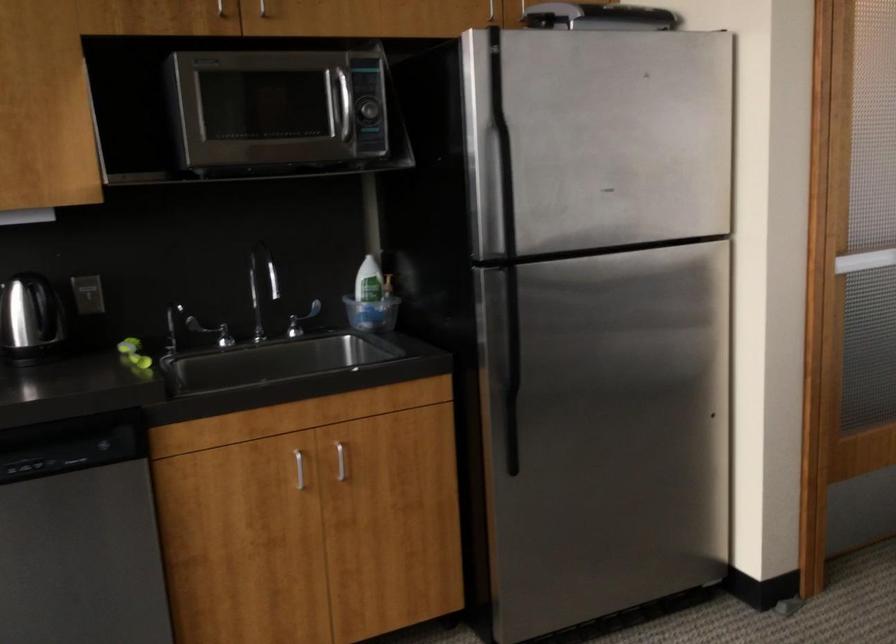
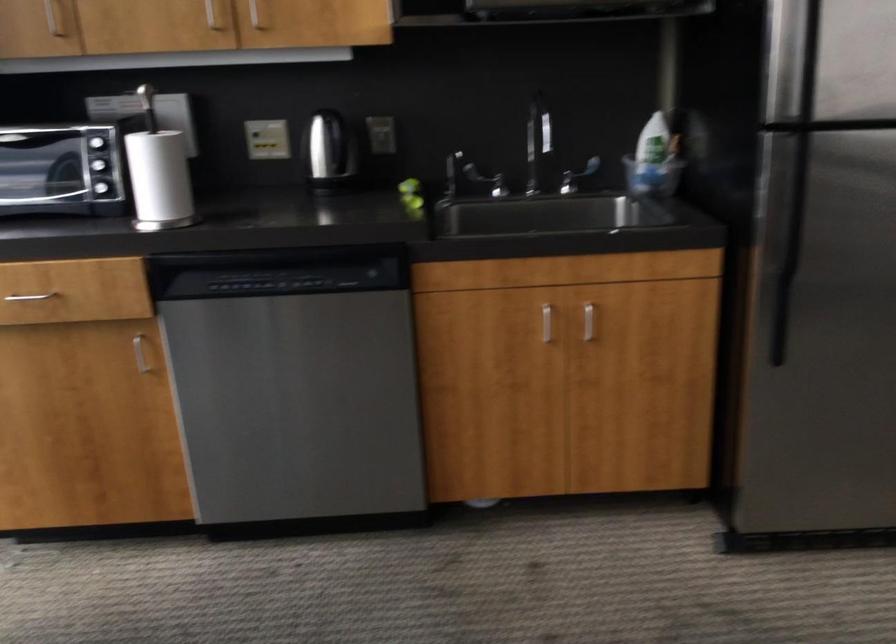
Question: I am providing you with two images of the same scene from different viewpoints. Please identify which objects are invisible in image2.

Choices:
 (A) silver cabinet handle
 (B) dish soap bottle
 (C) electric kettle handle
 (D) none of these

Answer: (D)